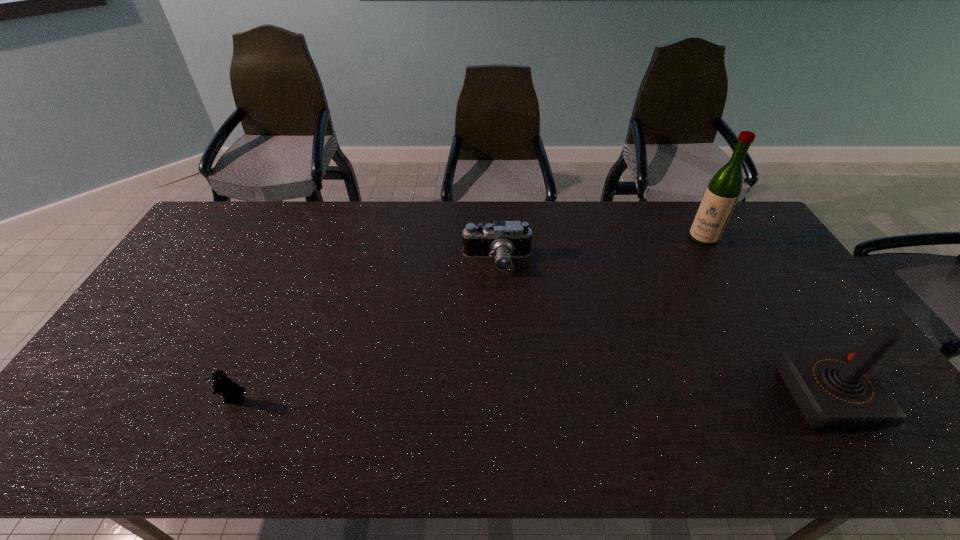
Locate an element on the screen. The width and height of the screenshot is (960, 540). vacant space situated 0.150m on the label of the tallest object is located at coordinates (682, 268).

The width and height of the screenshot is (960, 540). Identify the location of vacant region located 0.280m on the label of the tallest object. coord(665,290).

Identify the location of vacant space located 0.270m at the lens of the second farthest object. The width and height of the screenshot is (960, 540). (482, 344).

Locate an element on the screen. free space located 0.390m at the lens of the second farthest object is located at coordinates (476, 381).

You are a GUI agent. You are given a task and a screenshot of the screen. Output one action in this format:
    pyautogui.click(x=<x>, y=<y>)
    Task: Click on the vacant space located 0.150m at the lens of the second farthest object
    The image size is (960, 540).
    Given the screenshot: What is the action you would take?
    pyautogui.click(x=488, y=312)

I want to click on object that is at the far edge, so click(723, 191).

Where is `Lego that is at the near edge`? Lego that is at the near edge is located at coordinates (232, 393).

At what (x,y) coordinates should I click in order to perform the action: click on joystick present at the near edge. Please return your answer as a coordinate pair (x, y). This screenshot has width=960, height=540. Looking at the image, I should click on (835, 390).

Identify the location of object that is at the right edge. This screenshot has height=540, width=960. (835, 390).

The height and width of the screenshot is (540, 960). I want to click on object positioned at the near right corner, so click(x=835, y=390).